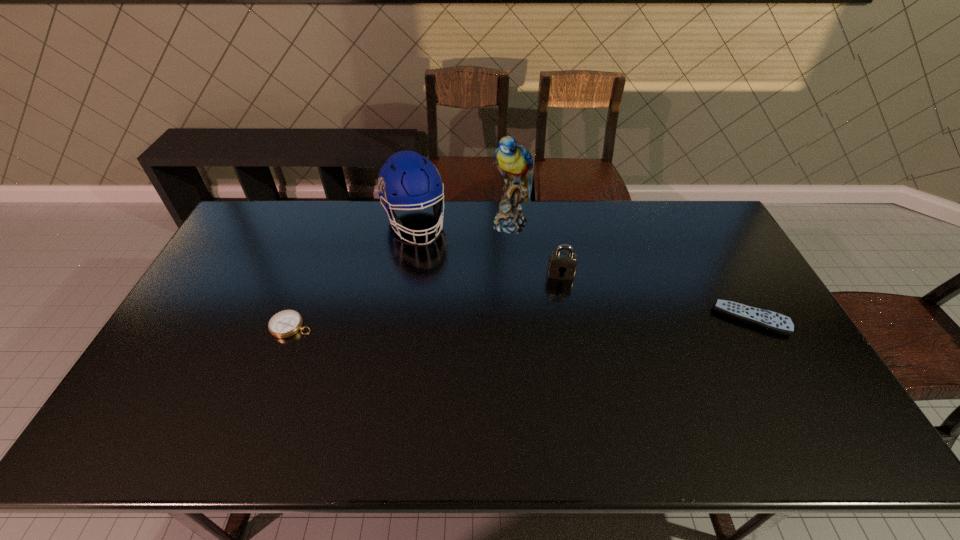
The width and height of the screenshot is (960, 540). I want to click on compass, so click(286, 323).

In order to click on the rightmost object in this screenshot , I will do `click(765, 319)`.

This screenshot has height=540, width=960. Identify the location of the tallest object. (514, 162).

The width and height of the screenshot is (960, 540). I want to click on the third object from right to left, so click(514, 162).

This screenshot has height=540, width=960. What are the coordinates of `football helmet` in the screenshot? It's located at (409, 180).

Identify the location of the fourth shortest object. This screenshot has height=540, width=960. (409, 180).

Find the location of a particular element. padlock is located at coordinates (562, 265).

Where is `the third tallest object`? This screenshot has width=960, height=540. the third tallest object is located at coordinates (562, 265).

Locate an element on the screen. Image resolution: width=960 pixels, height=540 pixels. vacant space located 0.270m on the right of the leftmost object is located at coordinates (406, 326).

The width and height of the screenshot is (960, 540). I want to click on free spot located on the back of the rightmost object, so click(727, 277).